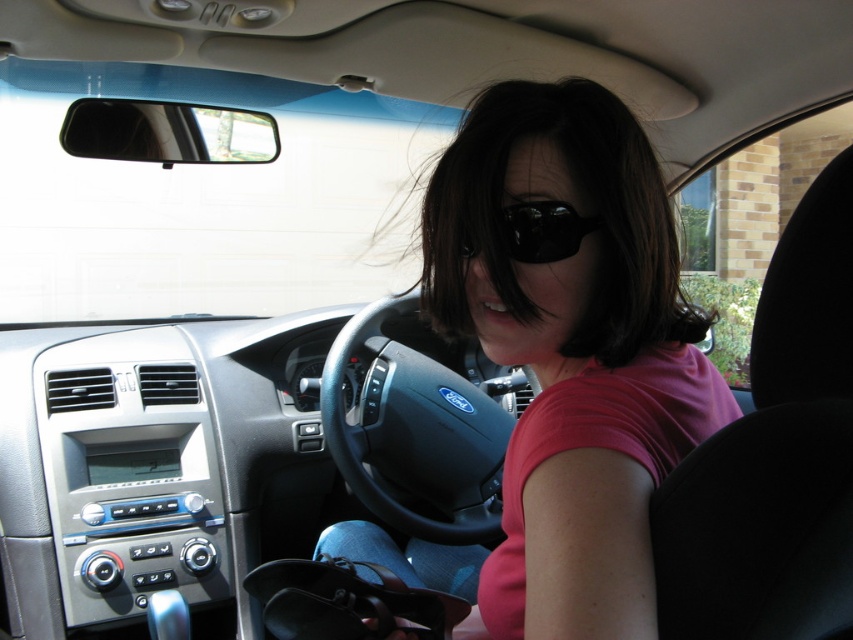
Which is more to the right, pink matte shirt at center or black reflective sunglasses at center?

pink matte shirt at center

Between pink matte shirt at center and black reflective sunglasses at center, which one is positioned higher?

black reflective sunglasses at center is higher up.

Is point (563, 288) positioned in front of point (515, 237)?

No, it is not.

The image size is (853, 640). In order to click on pink matte shirt at center in this screenshot , I will do `click(561, 364)`.